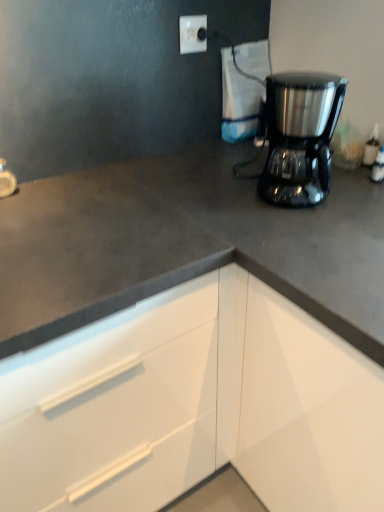
Locate an element on the screen. The height and width of the screenshot is (512, 384). vacant space to the right of white glossy faucet at upper left is located at coordinates (63, 194).